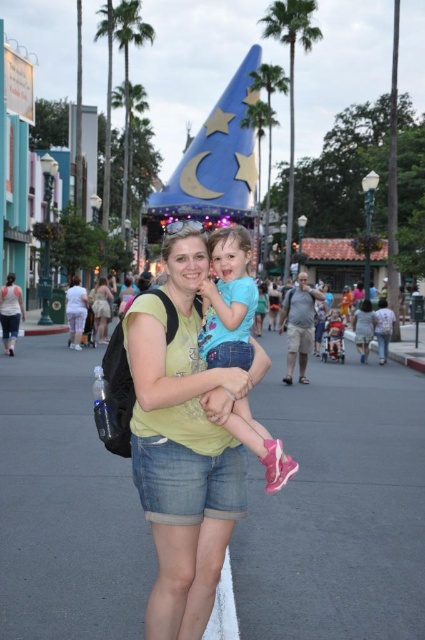
Is point (306, 24) farther from camera compared to point (82, 294)?

That is True.

Which is more to the left, green leafy palm tree at upper center or light pink cotton pants at center?

Positioned to the left is light pink cotton pants at center.

What do you see at coordinates (291, 74) in the screenshot? The height and width of the screenshot is (640, 425). I see `green leafy palm tree at upper center` at bounding box center [291, 74].

Find the location of a particular element. This screenshot has height=640, width=425. green leafy palm tree at upper center is located at coordinates (291, 74).

Locate an element on the screen. Image resolution: width=425 pixels, height=640 pixels. blue denim shorts at center is located at coordinates (229, 301).

Does point (201, 352) come in front of point (302, 22)?

Yes.

Which is behind, point (255, 422) or point (272, 1)?

The point (272, 1) is behind.

This screenshot has width=425, height=640. Identify the location of blue denim shorts at center. (229, 301).

Measure the distance between yellow matte arm at center and camera.

A distance of 46.86 feet exists between yellow matte arm at center and camera.

Is yellow matte arm at center thinner than white cotton tank top at lower left?

Incorrect, yellow matte arm at center's width is not less than white cotton tank top at lower left's.

Between point (240, 372) and point (22, 296), which one is positioned in front?

Point (240, 372) is in front.

This screenshot has height=640, width=425. I want to click on yellow matte arm at center, so pyautogui.click(x=164, y=369).